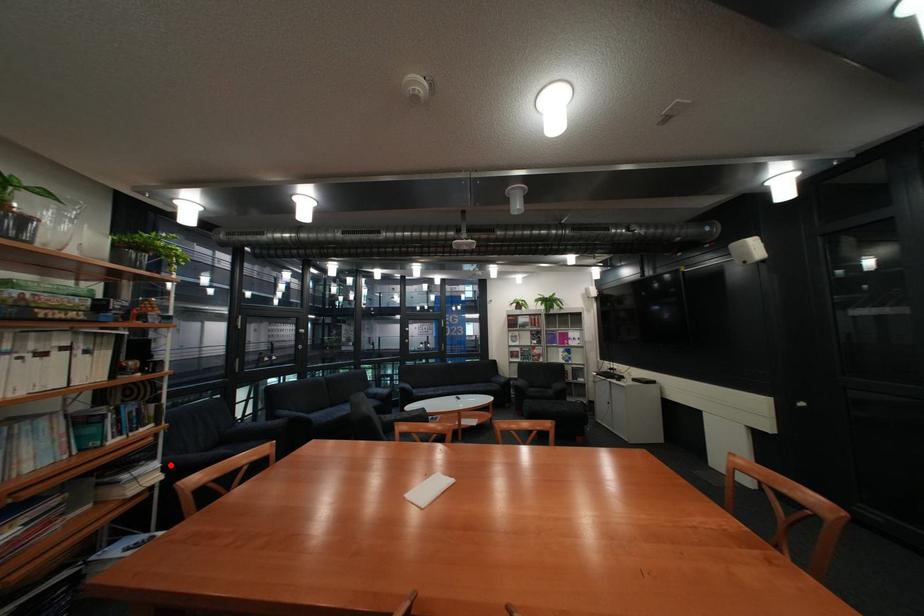
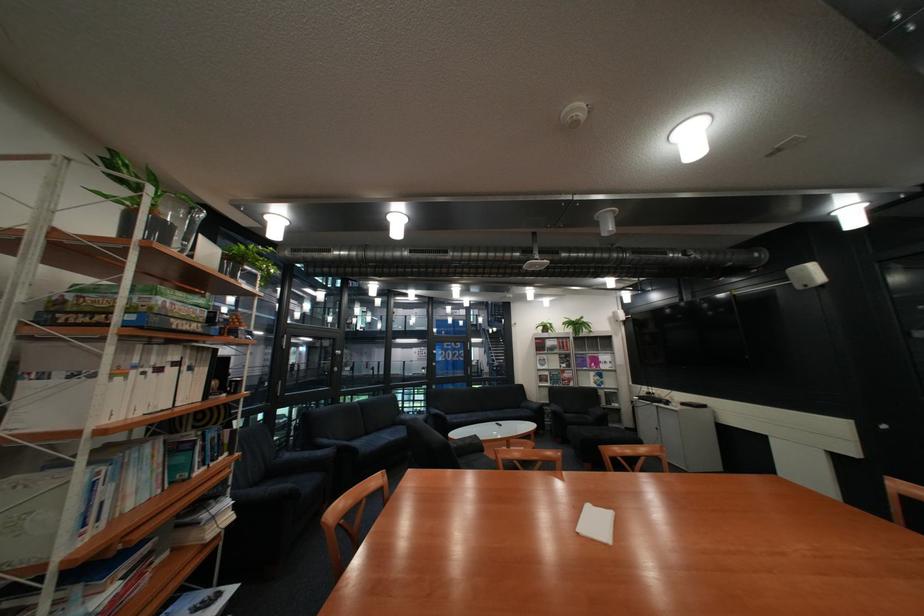
Find the pixel in the second image that matches the highlighted location in the first image.

(241, 501)